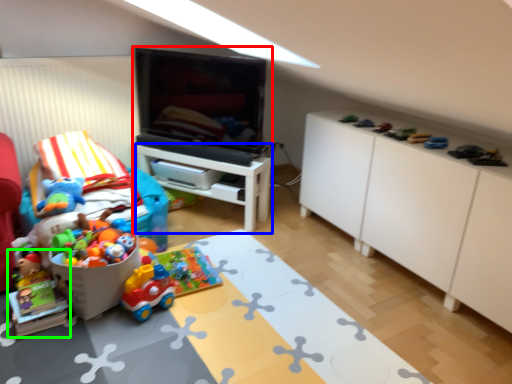
Question: Estimate the real-world distances between objects in this image. Which object is farther from entertainment center (highlighted by a red box), table (highlighted by a blue box) or toy (highlighted by a green box)?

Choices:
 (A) table
 (B) toy

Answer: (B)